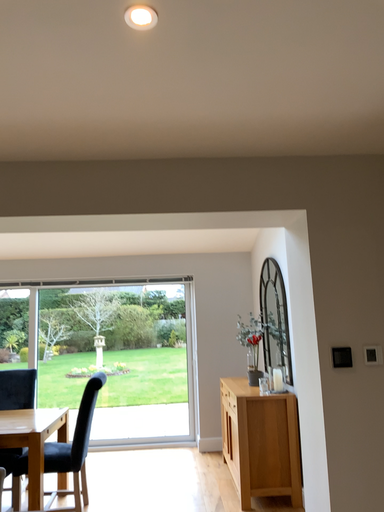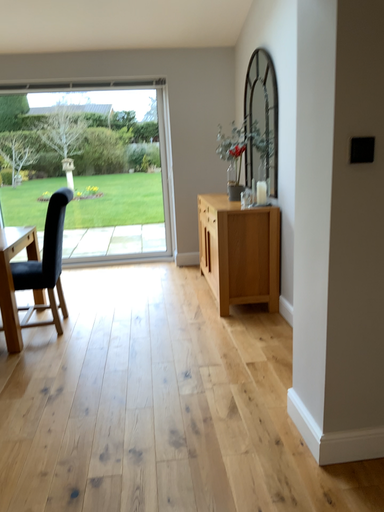
Question: Which way did the camera rotate in the video?

Choices:
 (A) rotated upward
 (B) rotated downward

Answer: (B)